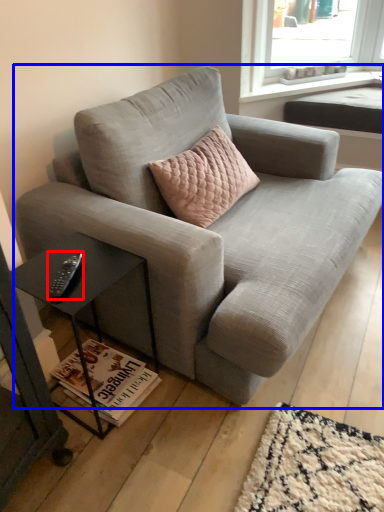
Question: Which of the following is the farthest to the observer, remote (highlighted by a red box) or studio couch (highlighted by a blue box)?

Choices:
 (A) remote
 (B) studio couch

Answer: (A)